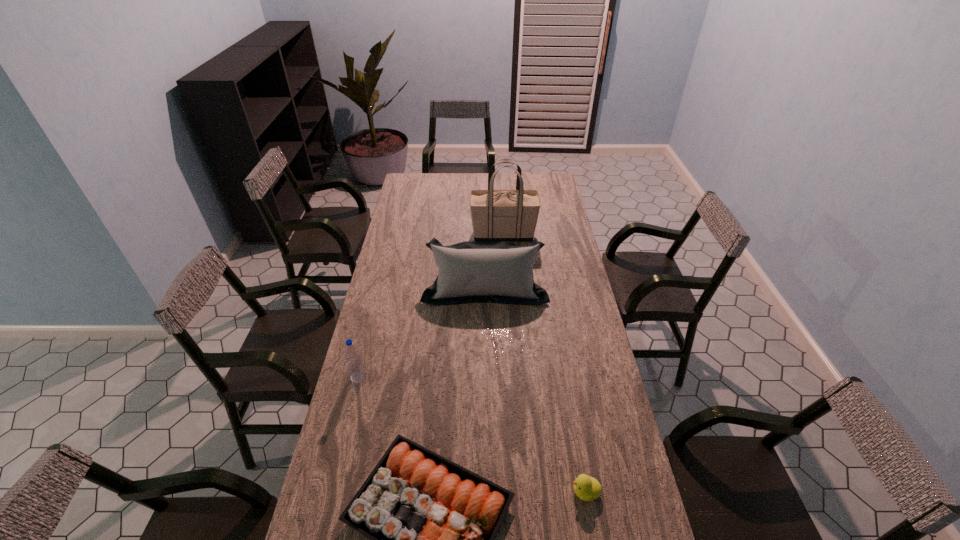
Identify the location of the tallest object. The image size is (960, 540). (497, 215).

Find the location of a particular element. shopping bag is located at coordinates pyautogui.click(x=497, y=215).

What are the coordinates of `cushion` in the screenshot? It's located at (472, 271).

This screenshot has height=540, width=960. Find the location of `water bottle`. water bottle is located at coordinates (355, 365).

At what (x,y) coordinates should I click in order to perform the action: click on the leftmost object. Please return your answer as a coordinate pair (x, y). Looking at the image, I should click on (355, 365).

This screenshot has width=960, height=540. In order to click on duckling in this screenshot , I will do `click(587, 488)`.

Where is `vacant area situated with handles facing forward on the farthest object`? vacant area situated with handles facing forward on the farthest object is located at coordinates (417, 235).

This screenshot has height=540, width=960. I want to click on free space located with handles facing forward on the farthest object, so click(438, 235).

Locate an element on the screen. The width and height of the screenshot is (960, 540). vacant space situated 0.340m with handles facing forward on the farthest object is located at coordinates (402, 235).

The height and width of the screenshot is (540, 960). What are the coordinates of `vacant area situated 0.160m on the surface of the second farthest object` in the screenshot? It's located at (486, 335).